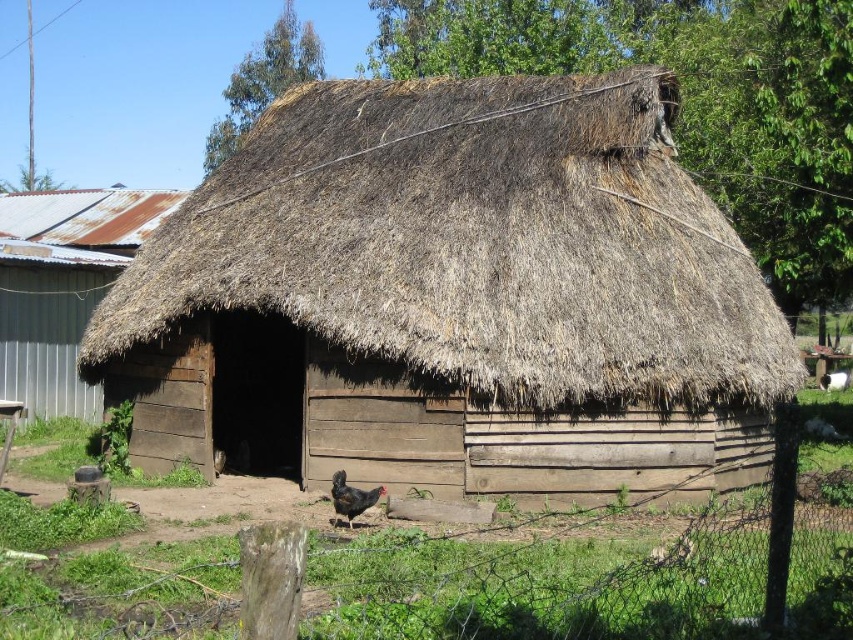
You are standing in front of the rustic wooden structure and want to move from the chicken to the entrance. Which point, point (144, 269) or point (405, 580), is closer to you as you walk towards the entrance?

Point (144, 269) is closer to you because it is further to the viewer than point (405, 580), meaning it is nearer in your line of sight as you approach the entrance.